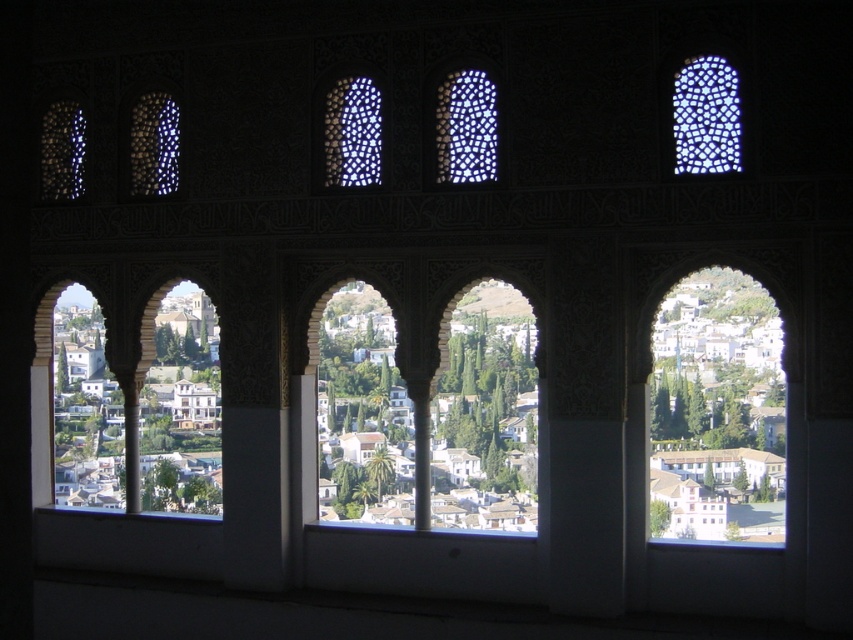
You are an architect analyzing the structural integrity of the green stone archway at center and the translucent glass lattice at upper left. Which of these two elements has a greater width?

The green stone archway at center has a greater width than the translucent glass lattice at upper left according to the description.

Looking at this image, you are an architect visiting this historical site and want to take a photo of both the green stone archway at center and the translucent glass lattice at upper left. Which object should you position to your left side in the camera frame to include both in the shot?

To include both the green stone archway at center and the translucent glass lattice at upper left in the shot, position the translucent glass lattice at upper left to your left side since the green stone archway at center is to the right of it.